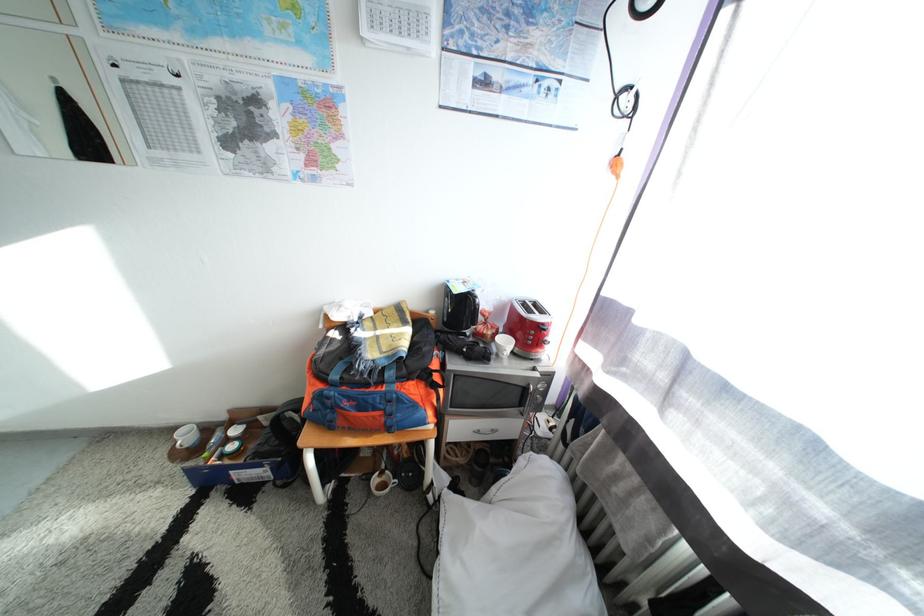
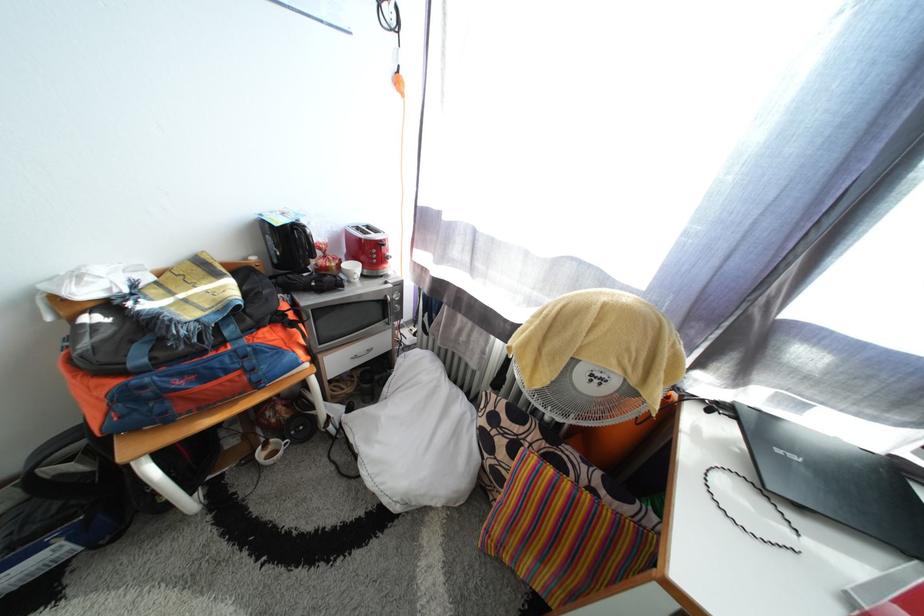
In the second image, find the point that corresponds to pixel 545 323 in the first image.

(383, 243)